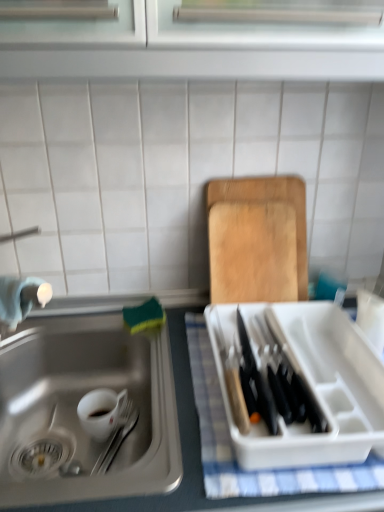
Question: In terms of height, does wooden cutting board at upper right look taller or shorter compared to stainless steel sink at lower left?

Choices:
 (A) tall
 (B) short

Answer: (A)

Question: From a real-world perspective, is wooden cutting board at upper right above or below stainless steel sink at lower left?

Choices:
 (A) above
 (B) below

Answer: (A)

Question: Which of these objects is positioned farthest from the stainless steel sink at lower left?

Choices:
 (A) white checkered cloth at right
 (B) wooden cutting board at upper right
 (C) white glossy mug at lower left

Answer: (B)

Question: Considering the real-world distances, which object is farthest from the white checkered cloth at right?

Choices:
 (A) white glossy mug at lower left
 (B) wooden cutting board at upper right
 (C) stainless steel sink at lower left

Answer: (A)